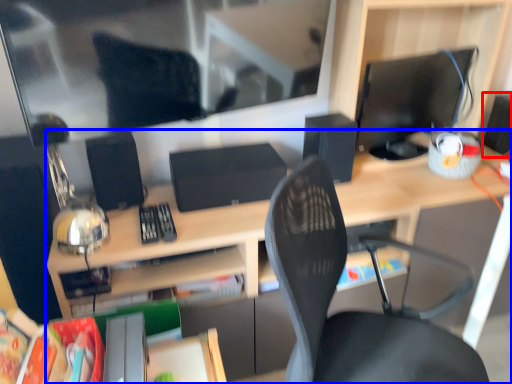
Question: Which of the following is the closest to the observer, speaker (highlighted by a red box) or desk (highlighted by a blue box)?

Choices:
 (A) speaker
 (B) desk

Answer: (B)